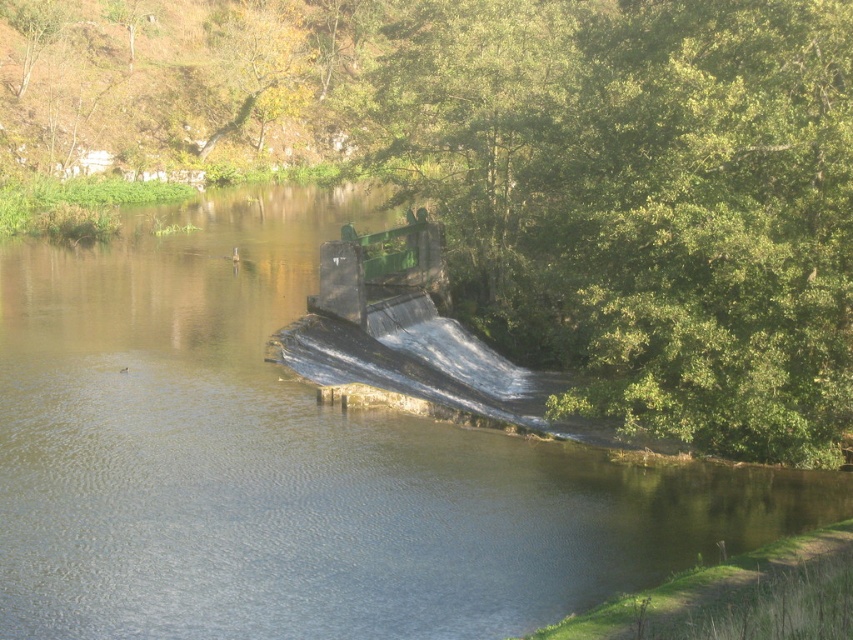
You are standing on a bridge overlooking the river and want to take a photo that captures both the green leafy tree at center and the green concrete dam at center. Which object will appear wider in the photo?

The green leafy tree at center will appear wider in the photo because its width is larger than that of the green concrete dam at center.

You are standing on the green concrete dam at center and want to look towards the dense green trees on the right side. Which direction should you turn to see the green leafy tree at center?

The green leafy tree at center is positioned on the left side of green concrete dam at center, so you should turn to your left to see the green leafy tree at center.